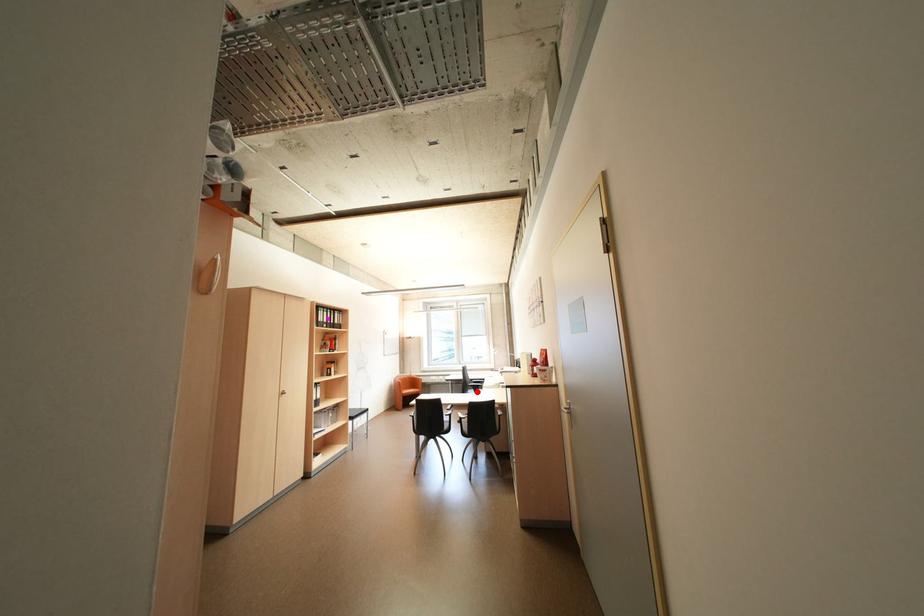
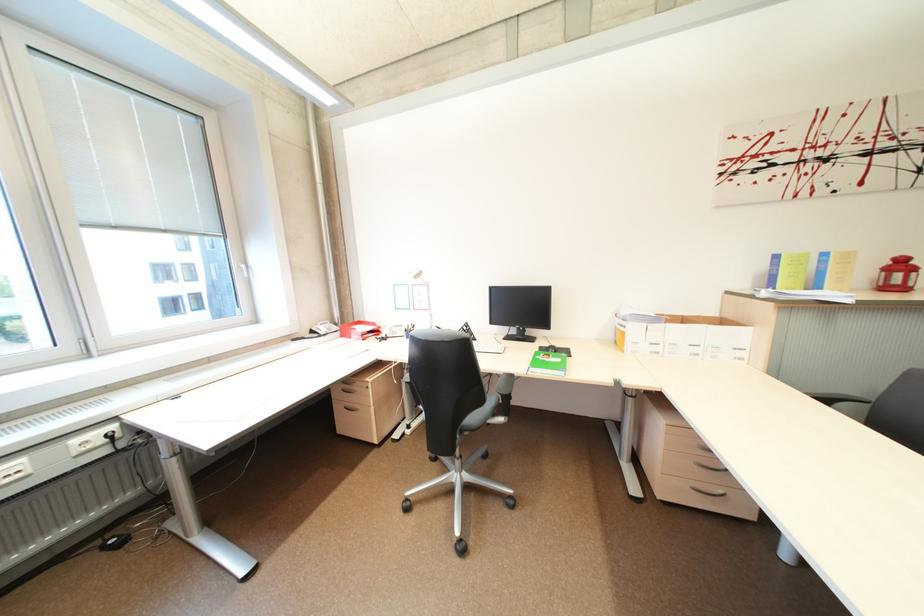
Question: I am providing you with two images of the same scene from different viewpoints. A red point is shown in image1. For the corresponding object point in image2, is it positioned nearer or farther from the camera?

Choices:
 (A) Nearer
 (B) Farther

Answer: (A)